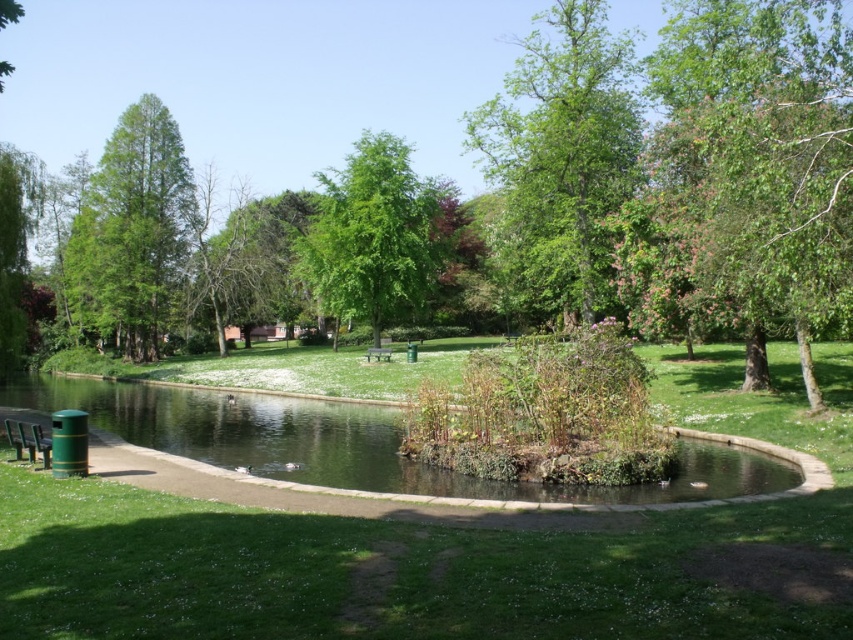
Is point (79, 381) closer to camera compared to point (28, 444)?

No, it is not.

Describe the element at coordinates (357, 444) in the screenshot. I see `green grassy water at lower left` at that location.

Does point (161, 424) come farther from viewer compared to point (16, 432)?

Yes.

The height and width of the screenshot is (640, 853). In order to click on green grassy water at lower left in this screenshot , I will do `click(357, 444)`.

Identify the location of green grassy water at lower left. click(357, 444).

Is point (161, 394) less distant than point (372, 348)?

Yes, point (161, 394) is closer to viewer.

Is point (683, 451) closer to camera compared to point (370, 348)?

Yes.

Find the location of a particular element. The width and height of the screenshot is (853, 640). green grassy water at lower left is located at coordinates (357, 444).

Is green leafy tree at upper right further to the viewer compared to green painted wood bench at lower left?

That is False.

Can you confirm if green leafy tree at upper right is bigger than green painted wood bench at lower left?

Correct, green leafy tree at upper right is larger in size than green painted wood bench at lower left.

This screenshot has height=640, width=853. I want to click on green leafy tree at upper right, so click(763, 163).

Locate an element on the screen. This screenshot has height=640, width=853. green leafy tree at upper right is located at coordinates (763, 163).